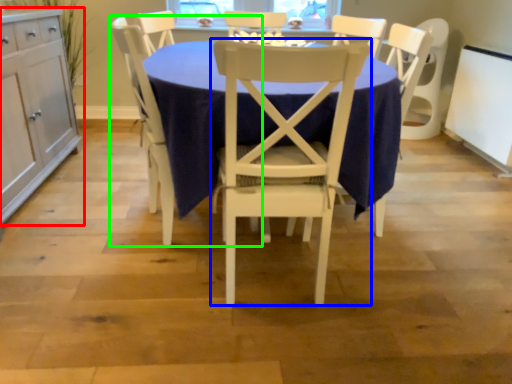
Question: Considering the real-world distances, which object is closest to cabinetry (highlighted by a red box)? chair (highlighted by a blue box) or chair (highlighted by a green box).

Choices:
 (A) chair
 (B) chair

Answer: (B)